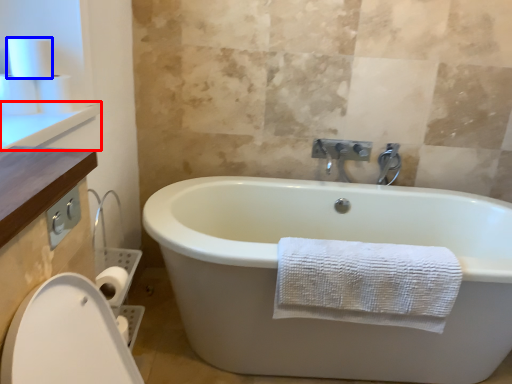
Question: Which object appears closest to the camera in this image, counter top (highlighted by a red box) or toilet paper (highlighted by a blue box)?

Choices:
 (A) counter top
 (B) toilet paper

Answer: (A)